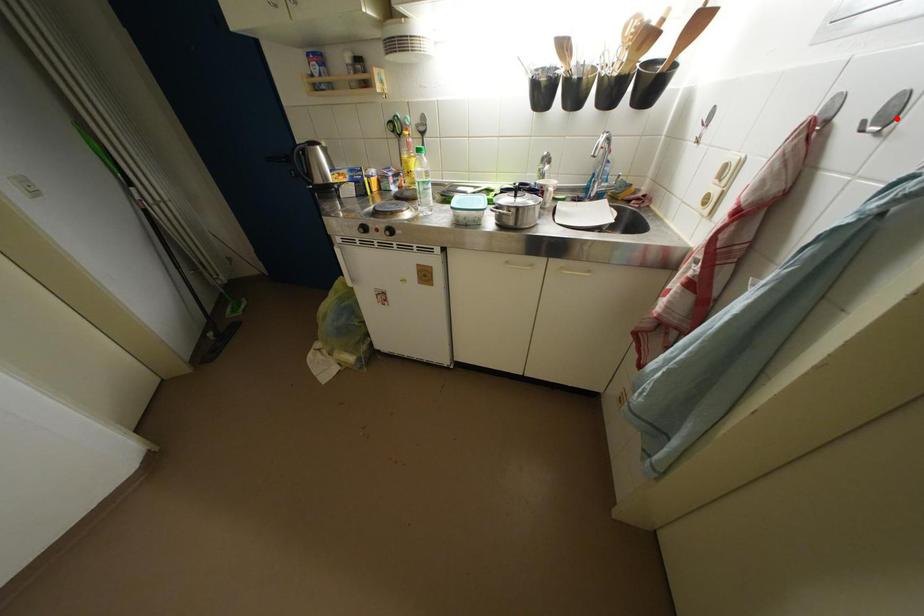
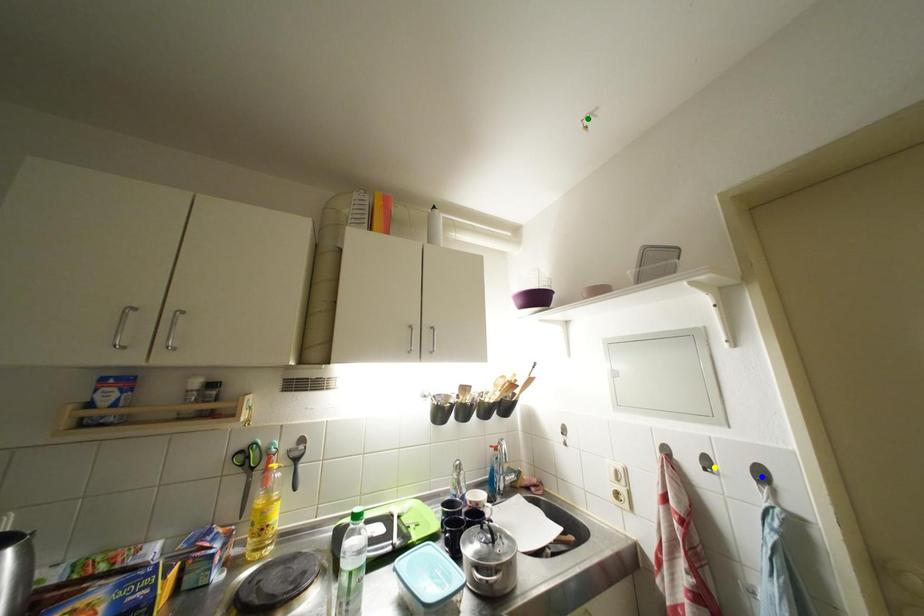
Question: I am providing you with two images of the same scene from different viewpoints. A red point is marked on the first image. You are given multiple points on the second image. In image 2, which mark is for the same physical point as the one in image 1?

Choices:
 (A) green point
 (B) blue point
 (C) yellow point

Answer: (C)